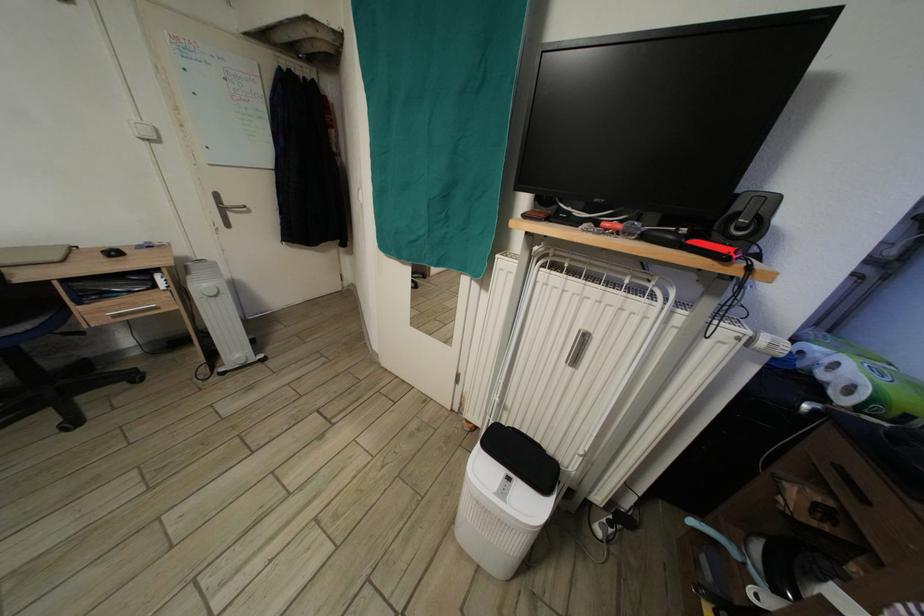
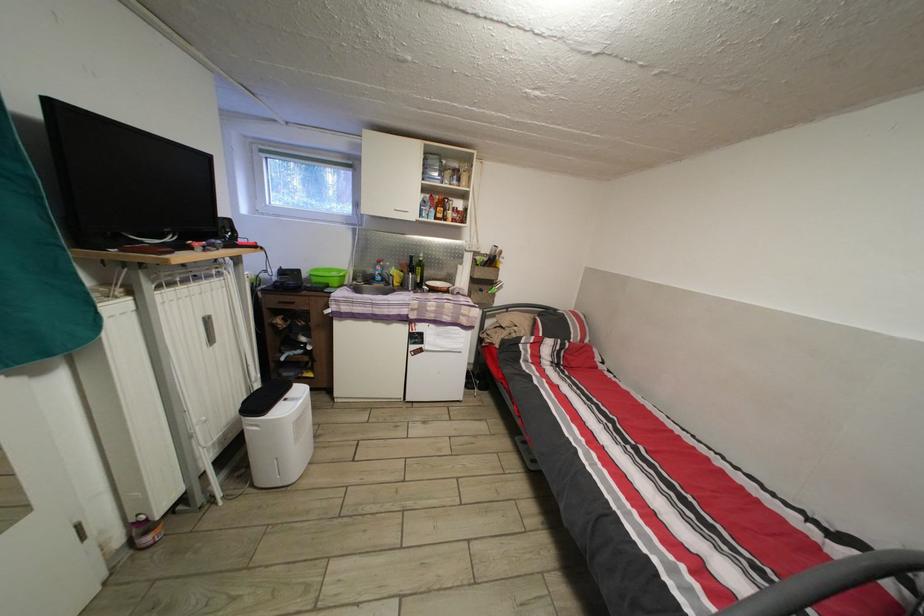
In the second image, find the point that corresponds to point (601, 296) in the first image.

(201, 294)